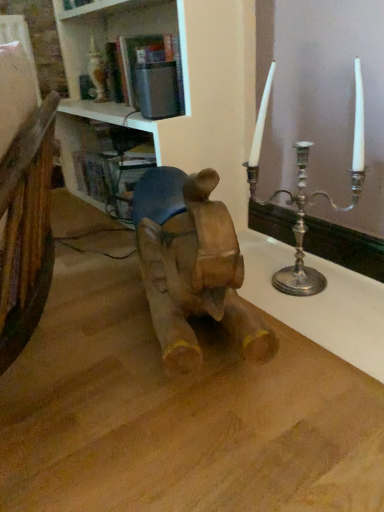
What are the coordinates of `vacant space underneath silver metallic candlestick at upper right (from a real-world perspective)` in the screenshot? It's located at (291, 289).